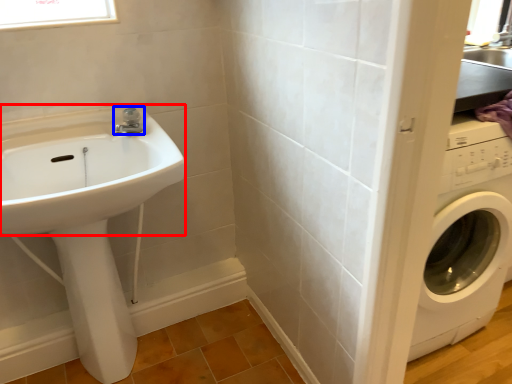
Question: Among these objects, which one is farthest to the camera, sink (highlighted by a red box) or tap (highlighted by a blue box)?

Choices:
 (A) sink
 (B) tap

Answer: (B)